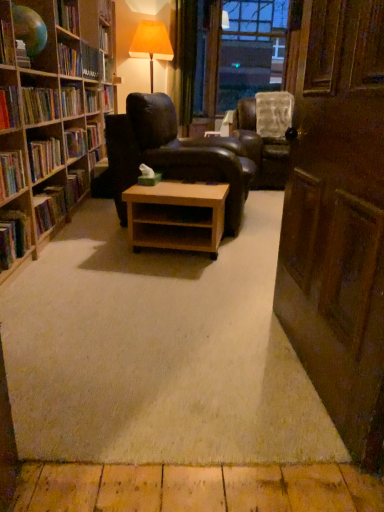
You are a GUI agent. You are given a task and a screenshot of the screen. Output one action in this format:
    pyautogui.click(x=<x>, y=<y>)
    Task: Click on the vacant space underneath wooden door at right (from a real-world perspective)
    The image size is (384, 512).
    Given the screenshot: What is the action you would take?
    pyautogui.click(x=299, y=369)